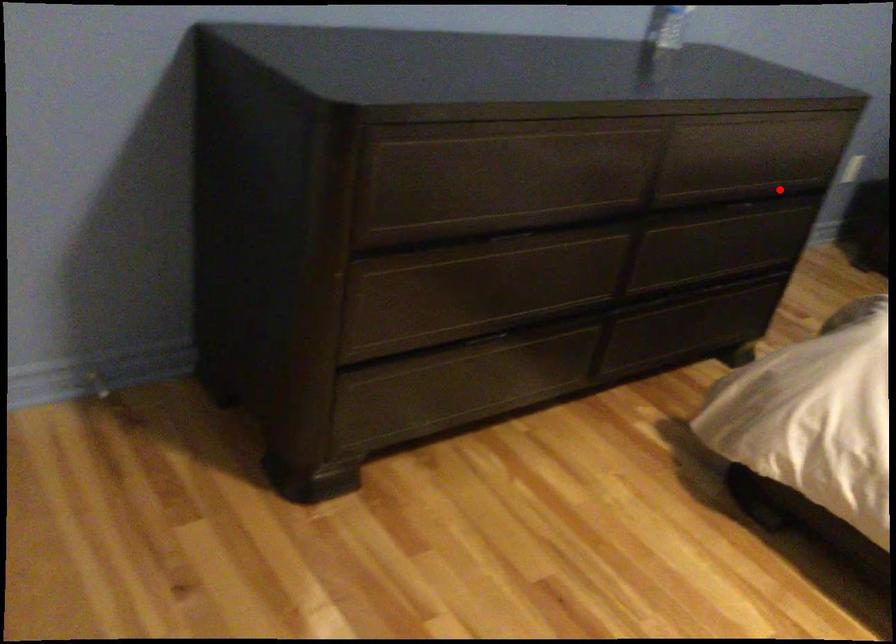
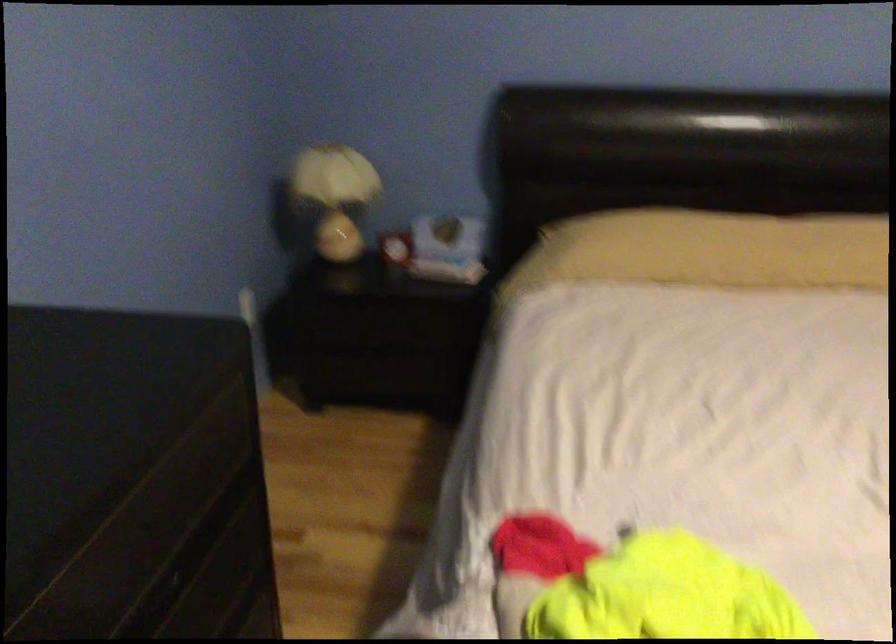
The point at the highlighted location is marked in the first image. Where is the corresponding point in the second image?

(186, 559)